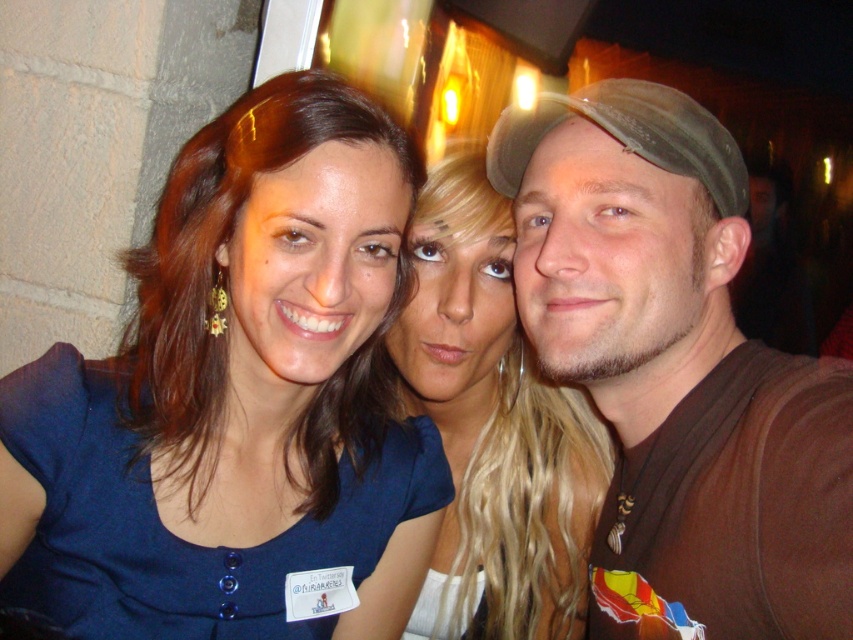
Question: Among these objects, which one is farthest from the camera?

Choices:
 (A) brown fabric shirt at center
 (B) green fabric baseball cap at right

Answer: (B)

Question: Observing the image, what is the correct spatial positioning of blue fabric dress at upper left in reference to green fabric baseball cap at right?

Choices:
 (A) below
 (B) above

Answer: (A)

Question: In this image, where is blue fabric dress at upper left located relative to brown fabric shirt at center?

Choices:
 (A) above
 (B) below

Answer: (B)

Question: Which is farther from the green fabric baseball cap at right?

Choices:
 (A) brown fabric shirt at center
 (B) blue fabric dress at upper left

Answer: (B)

Question: Among these points, which one is farthest from the camera?

Choices:
 (A) (701, 404)
 (B) (410, 244)
 (C) (492, 177)

Answer: (B)

Question: Does blue fabric dress at upper left have a greater width compared to blonde hair at center?

Choices:
 (A) no
 (B) yes

Answer: (B)